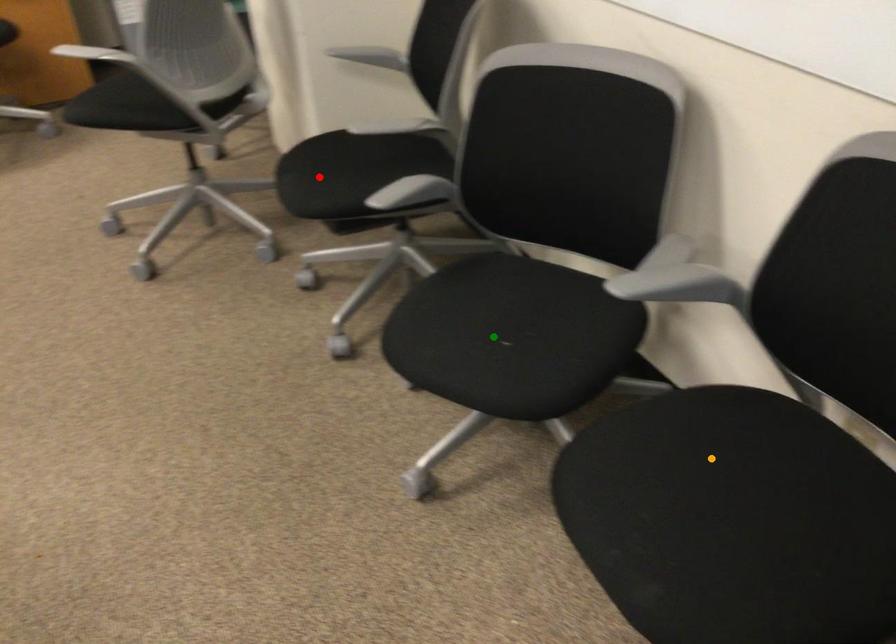
Order these from nearest to farthest:
- red point
- orange point
- green point

orange point, green point, red point